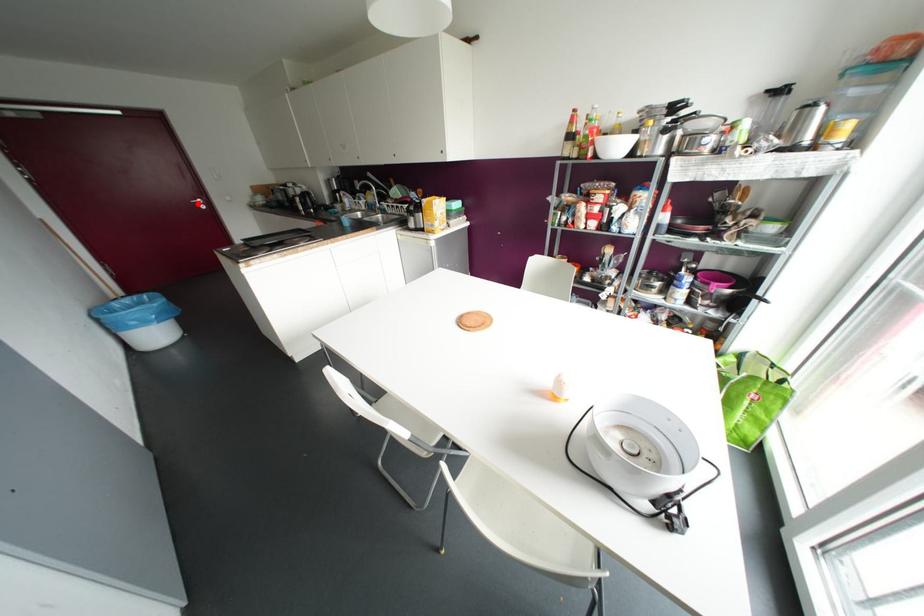
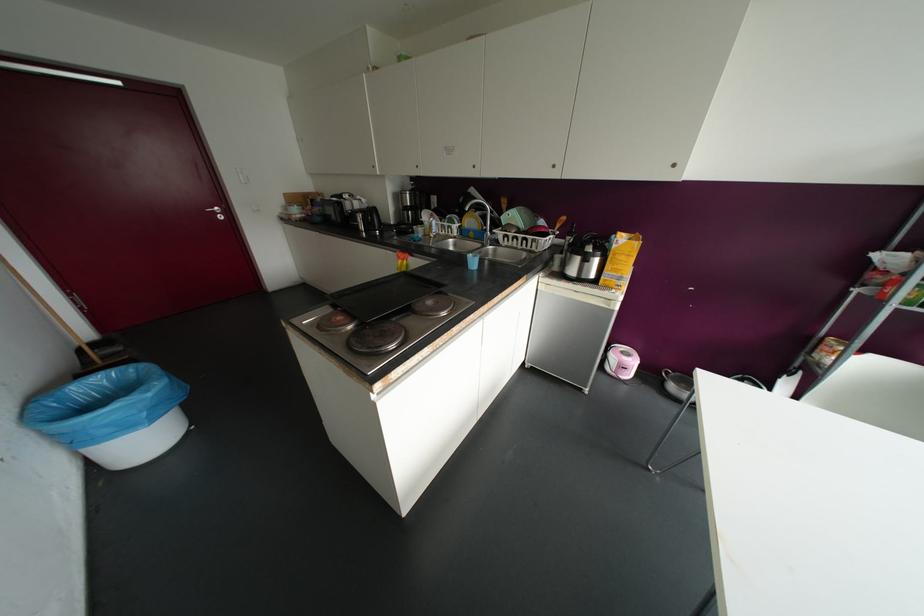
Question: I am providing you with two images of the same scene from different viewpoints. Image1 has a red point marked. In image2, the corresponding 3D location appears at what relative position? Reply with the corresponding letter.

Choices:
 (A) Closer
 (B) Farther

Answer: (B)